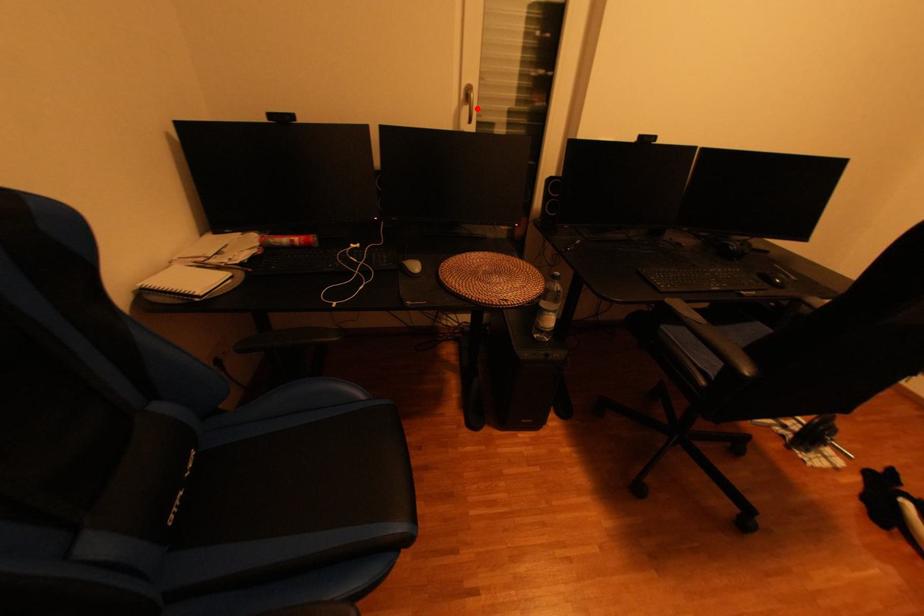
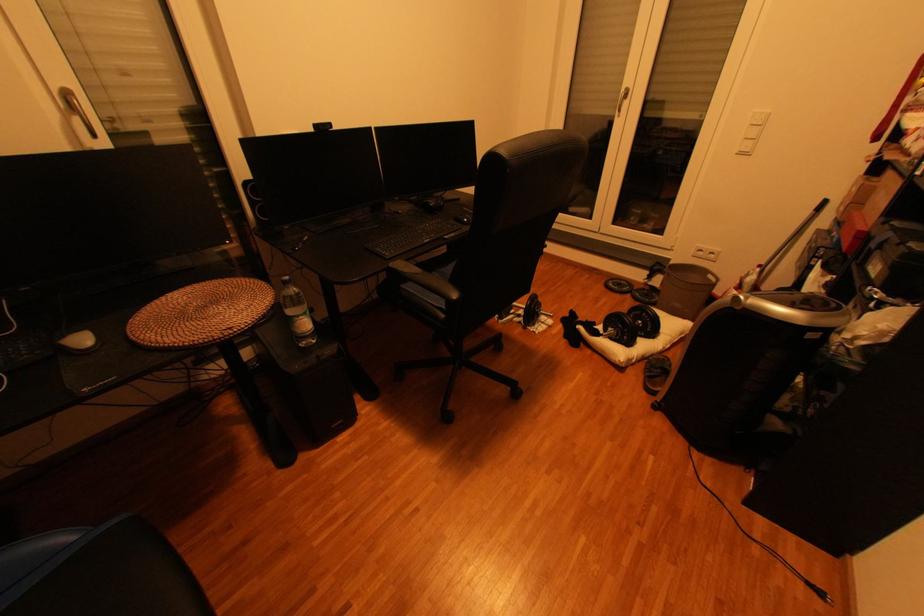
Question: I am providing you with two images of the same scene from different viewpoints. Given a red point in image1, look at the same physical point in image2. Is it:

Choices:
 (A) Closer to the viewpoint
 (B) Farther from the viewpoint

Answer: (B)